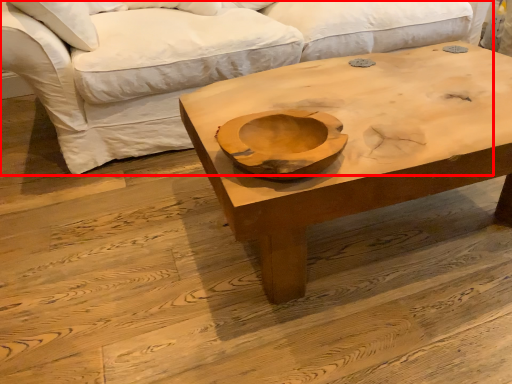
Question: Where is studio couch (annotated by the red box) located in relation to coffee table in the image?

Choices:
 (A) left
 (B) right

Answer: (A)